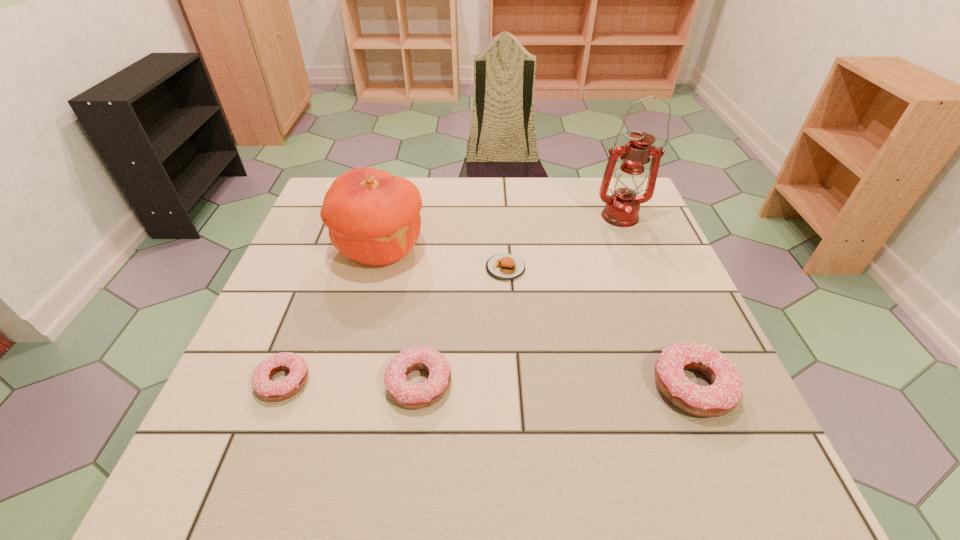
You are a GUI agent. You are given a task and a screenshot of the screen. Output one action in this format:
    pyautogui.click(x=<x>, y=<y>)
    Task: Click on the empty space that is in between the fourth shortest object and the pumpkin
    
    Given the screenshot: What is the action you would take?
    pyautogui.click(x=537, y=318)

Identify the location of unoccupied area between the tallest doughnut and the pumpkin. (537, 318).

Locate an element on the screen. The height and width of the screenshot is (540, 960). empty location between the fourth tallest object and the food is located at coordinates (462, 326).

This screenshot has width=960, height=540. I want to click on free space between the second tallest doughnut and the pumpkin, so click(399, 316).

This screenshot has width=960, height=540. I want to click on vacant region between the pumpkin and the rightmost doughnut, so click(x=537, y=318).

Locate an element on the screen. This screenshot has height=540, width=960. empty space between the fourth object from left to right and the oil lamp is located at coordinates (563, 242).

Find the location of a particular element. This screenshot has height=540, width=960. free point between the pumpkin and the food is located at coordinates (443, 258).

The width and height of the screenshot is (960, 540). Identify the location of free space between the shortest doughnut and the rightmost doughnut. (488, 384).

At what (x,y) coordinates should I click in order to perform the action: click on free spot between the second doughnut from left to right and the tallest doughnut. Please return your answer as a coordinate pair (x, y). Image resolution: width=960 pixels, height=540 pixels. Looking at the image, I should click on (556, 385).

Find the location of `object that ranks as the second closest to the second doughnut from right to left`. object that ranks as the second closest to the second doughnut from right to left is located at coordinates (373, 217).